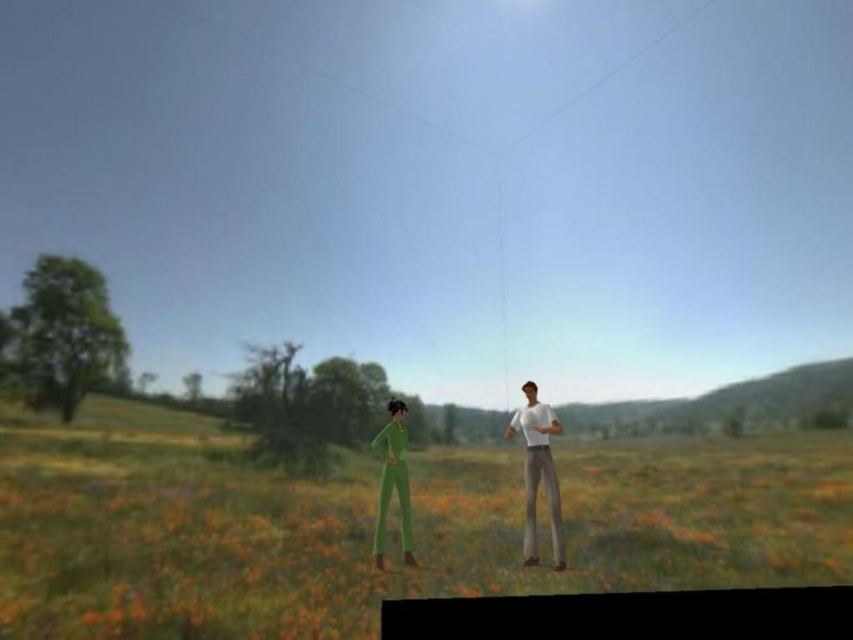
You are a photographer trying to capture both the white matte pants at right and the green matte jumpsuit at lower left in a single frame. Based on their positions, which character should you adjust your camera angle to focus on first to ensure both are in the frame?

The green matte jumpsuit at lower left should be focused on first since the white matte pants at right is positioned to the right of it, allowing the photographer to adjust the angle to include both in the frame.